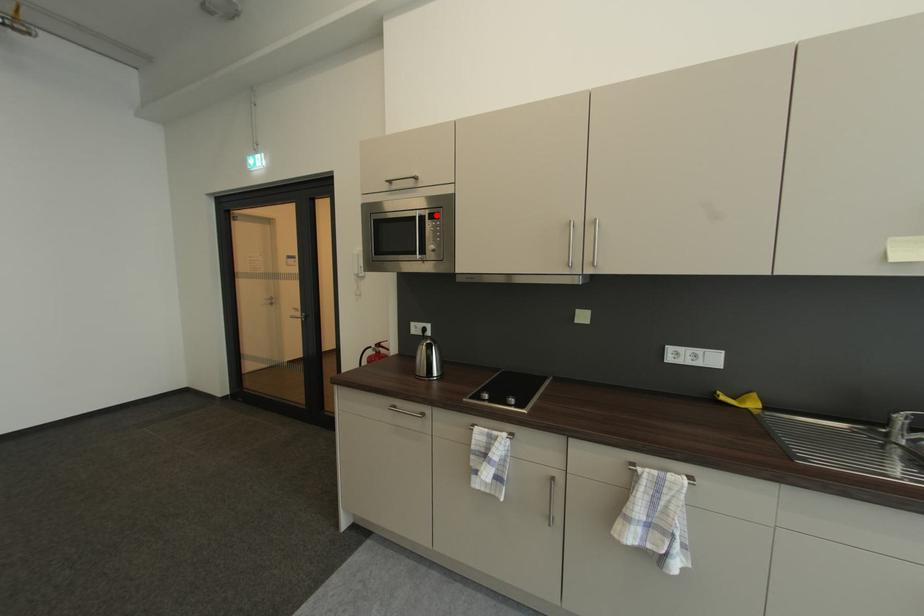
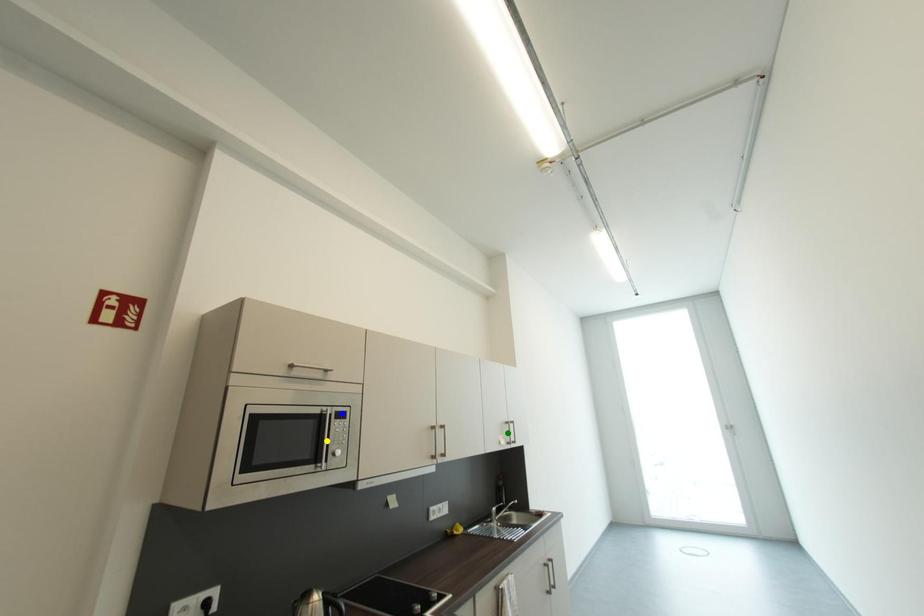
Question: I am providing you with two images of the same scene from different viewpoints. A red point is marked on the first image. You are given multiple points on the second image. Which point in image 2 represents the same 3d spot as the red point in image 1?

Choices:
 (A) yellow point
 (B) blue point
 (C) green point

Answer: (B)